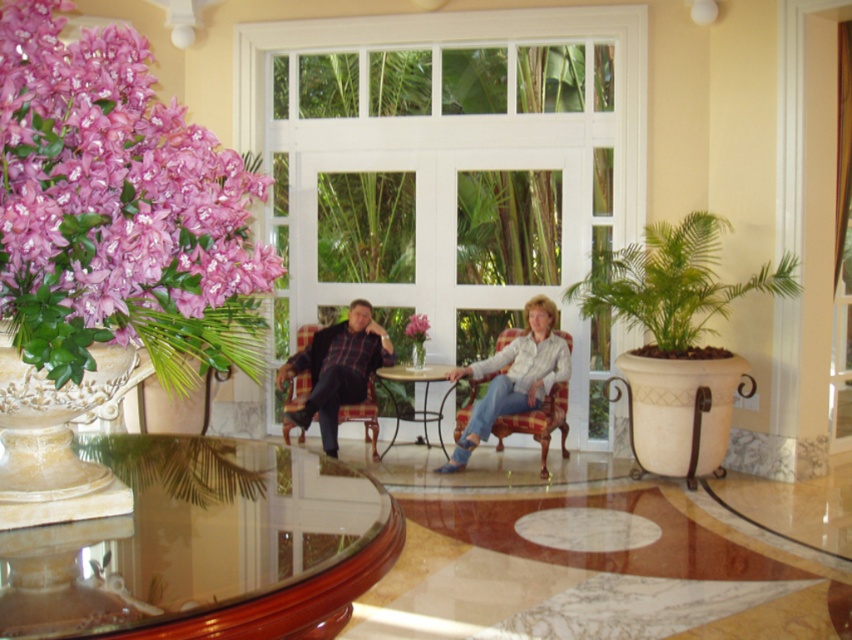
Question: Is plaid fabric chair at center above pink matte flower at center?

Choices:
 (A) no
 (B) yes

Answer: (A)

Question: Where is pink silk flowers at left located in relation to plaid fabric chair at center in the image?

Choices:
 (A) left
 (B) right

Answer: (B)

Question: Which object is the closest to the pink matte flower at center?

Choices:
 (A) transparent glass table at center
 (B) wooden round table at center
 (C) pink silk flowers at left

Answer: (B)

Question: Can you confirm if pink silk flowers at left is positioned above plaid fabric armchair at center?

Choices:
 (A) no
 (B) yes

Answer: (B)

Question: Which point is closer to the camera?

Choices:
 (A) plaid fabric chair at center
 (B) matte plaid shirt at center
 (C) wooden round table at center
 (D) pink matte flower at center

Answer: (A)

Question: Which point appears closest to the camera in this image?

Choices:
 (A) (394, 406)
 (B) (540, 444)
 (C) (114, 232)
 (D) (330, 422)

Answer: (C)